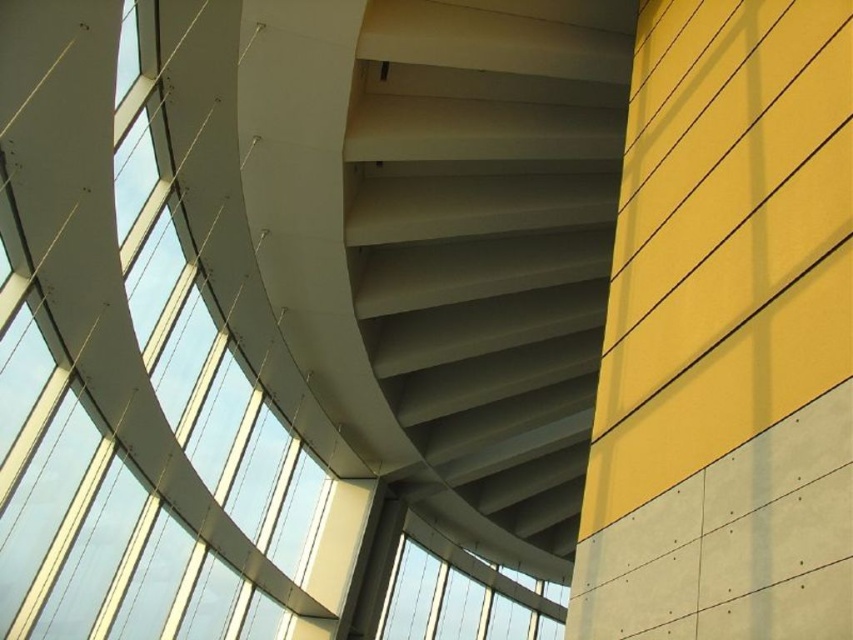
In the scene shown: Which is more to the left, smooth concrete stairs at center or transparent glass window at center?

transparent glass window at center is more to the left.

Between point (590, 332) and point (419, 600), which one is positioned behind?

The point (419, 600) is behind.

Does point (473, 51) lie behind point (547, 625)?

No, (473, 51) is in front of (547, 625).

Where is `smooth concrete stairs at center`? smooth concrete stairs at center is located at coordinates (488, 236).